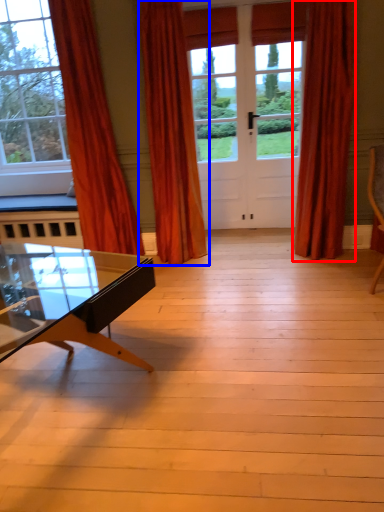
Question: Which object appears closest to the camera in this image, curtain (highlighted by a red box) or curtain (highlighted by a blue box)?

Choices:
 (A) curtain
 (B) curtain

Answer: (B)